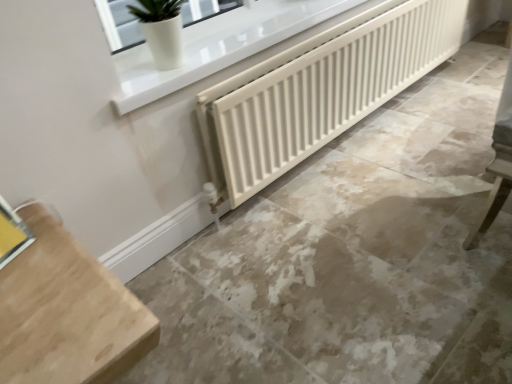
Describe the element at coordinates (319, 90) in the screenshot. Image resolution: width=512 pixels, height=384 pixels. I see `white matte radiator at center` at that location.

This screenshot has width=512, height=384. What are the coordinates of `white matte radiator at center` in the screenshot? It's located at (319, 90).

I want to click on yellow cardboard at lower left, which is the first window in bottom-to-top order, so point(12,234).

The image size is (512, 384). Find the location of `white matte radiator at center`. white matte radiator at center is located at coordinates click(319, 90).

From a real-world perspective, does white matte radiator at center stand above white glossy pot at upper left, the 2th window from the left?

No, from a real-world perspective, white matte radiator at center is not on top of white glossy pot at upper left, the 2th window from the left.

Is white matte radiator at center behind white glossy pot at upper left, the first window in the top-to-bottom sequence?

Yes, white matte radiator at center is behind white glossy pot at upper left, the first window in the top-to-bottom sequence.

Is white glossy pot at upper left, the 2th window ordered from the bottom, surrounded by white matte radiator at center?

No, white glossy pot at upper left, the 2th window ordered from the bottom, is not a part of white matte radiator at center.

Considering the positions of points (260, 83) and (223, 5), is point (260, 83) closer to camera compared to point (223, 5)?

That is True.

From the image's perspective, which one is positioned lower, white matte radiator at center or light wood table at lower left?

From the image's view, light wood table at lower left is below.

Is white matte radiator at center facing away from light wood table at lower left?

No, white matte radiator at center is not facing away from light wood table at lower left.

Which is behind, white matte radiator at center or light wood table at lower left?

white matte radiator at center is further away from the camera.

Is white matte radiator at center positioned beyond the bounds of light wood table at lower left?

Yes, white matte radiator at center is outside of light wood table at lower left.

From a real-world perspective, is white glossy pot at upper left, the 2th window ordered from the bottom, under beige marble floor at center?

No, from a real-world perspective, white glossy pot at upper left, the 2th window ordered from the bottom, is not beneath beige marble floor at center.

Considering the positions of objects white glossy pot at upper left, the 2th window from the left, and beige marble floor at center in the image provided, who is more to the left, white glossy pot at upper left, the 2th window from the left, or beige marble floor at center?

Positioned to the left is white glossy pot at upper left, the 2th window from the left.

Which of these two, white glossy pot at upper left, the first window from the right, or beige marble floor at center, stands shorter?

With less height is beige marble floor at center.

Is white glossy pot at upper left, the first window from the right, inside or outside of beige marble floor at center?

white glossy pot at upper left, the first window from the right, is not enclosed by beige marble floor at center.

Does light wood table at lower left have a larger size compared to white matte radiator at center?

Correct, light wood table at lower left is larger in size than white matte radiator at center.

Would you consider light wood table at lower left to be distant from white matte radiator at center?

Yes, light wood table at lower left and white matte radiator at center are quite far apart.

From the image's perspective, does light wood table at lower left appear higher than white matte radiator at center?

No.

Is light wood table at lower left turned away from white matte radiator at center?

No, light wood table at lower left's orientation is not away from white matte radiator at center.

In the image, is yellow cardboard at lower left, the 1th window when ordered from front to back, positioned in front of or behind white matte radiator at center?

Clearly, yellow cardboard at lower left, the 1th window when ordered from front to back, is in front of white matte radiator at center.

Is yellow cardboard at lower left, which is counted as the first window, starting from the left, smaller than white matte radiator at center?

Indeed, yellow cardboard at lower left, which is counted as the first window, starting from the left, has a smaller size compared to white matte radiator at center.

This screenshot has height=384, width=512. Find the location of `the 2nd window in front of the white matte radiator at center, starting your count from the anchor`. the 2nd window in front of the white matte radiator at center, starting your count from the anchor is located at coordinates coord(12,234).

Does point (10, 249) lie in front of point (307, 45)?

Yes, it is.

Relative to light wood table at lower left, is white glossy pot at upper left, the first window in the top-to-bottom sequence, in front or behind?

white glossy pot at upper left, the first window in the top-to-bottom sequence, is positioned farther from the viewer than light wood table at lower left.

From the image's perspective, which one is positioned higher, white glossy pot at upper left, the first window in the top-to-bottom sequence, or light wood table at lower left?

white glossy pot at upper left, the first window in the top-to-bottom sequence.

Considering the sizes of objects white glossy pot at upper left, the 2th window from the left, and light wood table at lower left in the image provided, who is shorter, white glossy pot at upper left, the 2th window from the left, or light wood table at lower left?

white glossy pot at upper left, the 2th window from the left.

Is white glossy pot at upper left, the first window in the top-to-bottom sequence, inside or outside of light wood table at lower left?

white glossy pot at upper left, the first window in the top-to-bottom sequence, is spatially situated outside light wood table at lower left.

What are the coordinates of `furniture above the beige marble floor at center (from a real-world perspective)` in the screenshot? It's located at (67, 312).

Is there a large distance between beige marble floor at center and light wood table at lower left?

beige marble floor at center is actually quite close to light wood table at lower left.

Which is behind, point (301, 255) or point (26, 221)?

Point (301, 255)

Locate an element on the screen. The image size is (512, 384). radiator that is on the right side of white glossy pot at upper left, the first window in the top-to-bottom sequence is located at coordinates (319, 90).

At what (x,y) coordinates should I click in order to perform the action: click on radiator above the light wood table at lower left (from the image's perspective). Please return your answer as a coordinate pair (x, y). The image size is (512, 384). Looking at the image, I should click on (319, 90).

Estimate the real-world distances between objects in this image. Which object is further from white glossy pot at upper left, the first window in the top-to-bottom sequence, white matte radiator at center or light wood table at lower left?

Among the two, light wood table at lower left is located further to white glossy pot at upper left, the first window in the top-to-bottom sequence.

Looking at the image, which one is located closer to white matte radiator at center, light wood table at lower left or beige marble floor at center?

beige marble floor at center lies closer to white matte radiator at center than the other object.

From the picture: Which object lies nearer to the anchor point beige marble floor at center, light wood table at lower left or white glossy pot at upper left, the first window from the right?

The object closer to beige marble floor at center is light wood table at lower left.

Which object lies further to the anchor point yellow cardboard at lower left, the 2th window when ordered from right to left, white glossy pot at upper left, the first window from the right, or beige marble floor at center?

white glossy pot at upper left, the first window from the right, is positioned further to the anchor yellow cardboard at lower left, the 2th window when ordered from right to left.

Which object lies further to the anchor point yellow cardboard at lower left, which is the first window in bottom-to-top order, white matte radiator at center or beige marble floor at center?

Based on the image, white matte radiator at center appears to be further to yellow cardboard at lower left, which is the first window in bottom-to-top order.

Looking at the image, which one is located further to white glossy pot at upper left, placed as the second window when sorted from front to back, yellow cardboard at lower left, the second window viewed from the back, or light wood table at lower left?

light wood table at lower left lies further to white glossy pot at upper left, placed as the second window when sorted from front to back, than the other object.

When comparing their distances from light wood table at lower left, does beige marble floor at center or white matte radiator at center seem closer?

Among the two, beige marble floor at center is located nearer to light wood table at lower left.

Based on their spatial positions, is white matte radiator at center or yellow cardboard at lower left, the 1th window when ordered from front to back, closer to white glossy pot at upper left, placed as the second window when sorted from front to back?

white matte radiator at center is closer to white glossy pot at upper left, placed as the second window when sorted from front to back.

In order to click on radiator situated between yellow cardboard at lower left, the 2th window viewed from the top, and beige marble floor at center from left to right in this screenshot , I will do `click(319, 90)`.

This screenshot has width=512, height=384. Find the location of `furniture between yellow cardboard at lower left, the 2th window viewed from the top, and beige marble floor at center from left to right`. furniture between yellow cardboard at lower left, the 2th window viewed from the top, and beige marble floor at center from left to right is located at coordinates (67, 312).

Image resolution: width=512 pixels, height=384 pixels. Find the location of `window between yellow cardboard at lower left, the second window viewed from the back, and white matte radiator at center`. window between yellow cardboard at lower left, the second window viewed from the back, and white matte radiator at center is located at coordinates (120, 23).

At what (x,y) coordinates should I click in order to perform the action: click on window between white glossy pot at upper left, the 2th window from the left, and light wood table at lower left in the up-down direction. Please return your answer as a coordinate pair (x, y). Looking at the image, I should click on (12, 234).